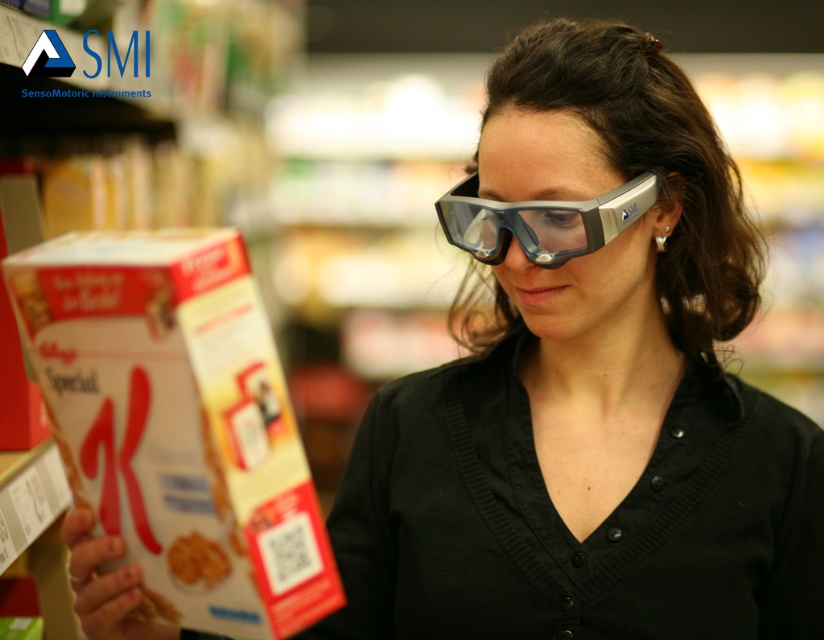
Question: Is white cardboard box at lower left to the left of transparent plastic goggles at center from the viewer's perspective?

Choices:
 (A) no
 (B) yes

Answer: (B)

Question: Which of the following is the farthest from the observer?

Choices:
 (A) (236, 552)
 (B) (620, 193)
 (C) (176, 548)

Answer: (B)

Question: Among these objects, which one is farthest from the camera?

Choices:
 (A) white cardboard box at lower left
 (B) golden crispy cereal at lower left
 (C) transparent plastic goggles at center

Answer: (C)

Question: Is white cardboard box at lower left above golden crispy cereal at lower left?

Choices:
 (A) yes
 (B) no

Answer: (A)

Question: Does white cardboard box at lower left appear under transparent plastic goggles at center?

Choices:
 (A) yes
 (B) no

Answer: (A)

Question: Which point is closer to the camera?

Choices:
 (A) (96, 456)
 (B) (176, 573)
 (C) (625, 205)

Answer: (B)